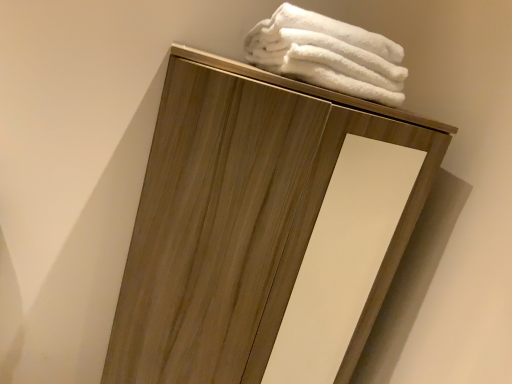
Image resolution: width=512 pixels, height=384 pixels. What do you see at coordinates (328, 54) in the screenshot? I see `white fluffy towels at upper center` at bounding box center [328, 54].

Where is `white fluffy towels at upper center`? This screenshot has height=384, width=512. white fluffy towels at upper center is located at coordinates (328, 54).

Locate an element on the screen. The height and width of the screenshot is (384, 512). white fluffy towels at upper center is located at coordinates (328, 54).